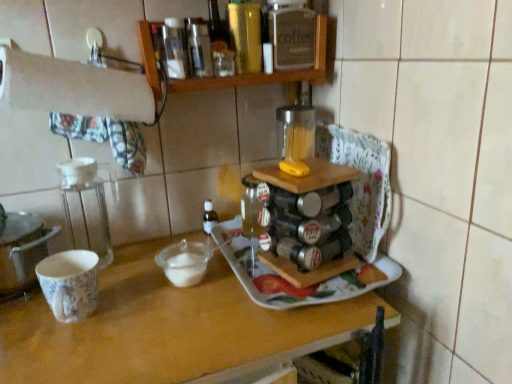
Where is `free space between transparent plastic container at left and white ceramic tray at center`? free space between transparent plastic container at left and white ceramic tray at center is located at coordinates (164, 276).